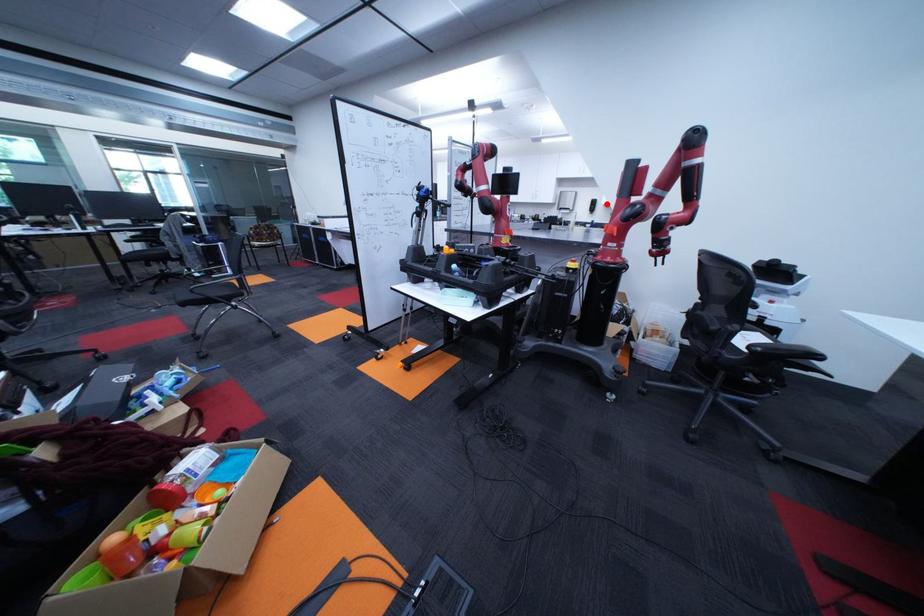
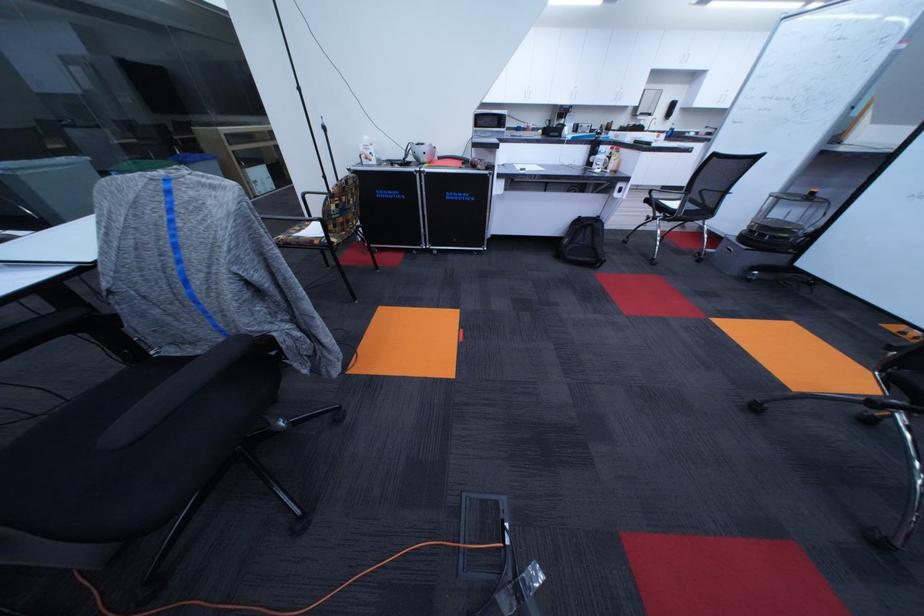
Question: A red point is marked in image1. In image2, is the corresponding 3D point closer to the camera or farther? Reply with the corresponding letter.

Choices:
 (A) The corresponding 3D point is closer.
 (B) The corresponding 3D point is farther.

Answer: (B)